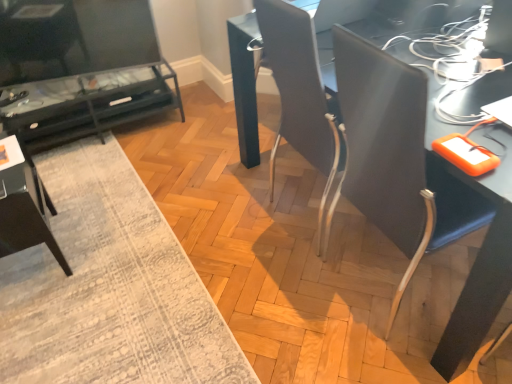
Question: Is matte black tv stand at left, the first table from the back, looking in the opposite direction of matte black desk at center?

Choices:
 (A) yes
 (B) no

Answer: (B)

Question: From a real-world perspective, is matte black tv stand at left, the 2th table from the right, on top of matte black desk at center?

Choices:
 (A) yes
 (B) no

Answer: (B)

Question: Is matte black tv stand at left, which ranks as the first table in left-to-right order, oriented towards matte black desk at center?

Choices:
 (A) no
 (B) yes

Answer: (B)

Question: Considering the relative sizes of matte black tv stand at left, the 2th table from the right, and matte black desk at center in the image provided, is matte black tv stand at left, the 2th table from the right, shorter than matte black desk at center?

Choices:
 (A) yes
 (B) no

Answer: (A)

Question: Does matte black tv stand at left, the 2th table from the right, have a greater height compared to matte black desk at center?

Choices:
 (A) yes
 (B) no

Answer: (B)

Question: Can you confirm if matte black tv stand at left, the first table from the back, is positioned to the right of matte black desk at center?

Choices:
 (A) no
 (B) yes

Answer: (A)

Question: Considering the relative sizes of dark gray fabric armchair at lower left and textured gray rug at lower left in the image provided, is dark gray fabric armchair at lower left smaller than textured gray rug at lower left?

Choices:
 (A) yes
 (B) no

Answer: (A)

Question: Is dark gray fabric armchair at lower left located outside textured gray rug at lower left?

Choices:
 (A) no
 (B) yes

Answer: (B)

Question: Considering the relative positions of dark gray fabric armchair at lower left and textured gray rug at lower left in the image provided, is dark gray fabric armchair at lower left behind textured gray rug at lower left?

Choices:
 (A) no
 (B) yes

Answer: (B)

Question: Considering the relative sizes of dark gray fabric armchair at lower left and textured gray rug at lower left in the image provided, is dark gray fabric armchair at lower left bigger than textured gray rug at lower left?

Choices:
 (A) yes
 (B) no

Answer: (B)

Question: Can you confirm if dark gray fabric armchair at lower left is wider than textured gray rug at lower left?

Choices:
 (A) no
 (B) yes

Answer: (A)

Question: Considering the relative positions of dark gray fabric armchair at lower left and textured gray rug at lower left in the image provided, is dark gray fabric armchair at lower left to the left of textured gray rug at lower left from the viewer's perspective?

Choices:
 (A) no
 (B) yes

Answer: (B)

Question: From the image's perspective, is dark gray fabric armchair at lower left below matte black tv stand at left, the first table from the back?

Choices:
 (A) no
 (B) yes

Answer: (B)